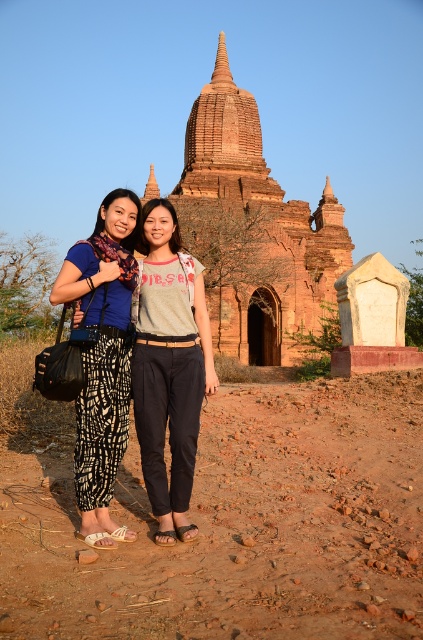
From the picture: Which of these two, brown dirt field at lower center or light gray cotton shirt at center, stands taller?

With more height is light gray cotton shirt at center.

Describe the element at coordinates (238, 525) in the screenshot. I see `brown dirt field at lower center` at that location.

The width and height of the screenshot is (423, 640). I want to click on brown dirt field at lower center, so click(238, 525).

Does rustic brick temple at center appear on the left side of light gray cotton shirt at center?

No, rustic brick temple at center is not to the left of light gray cotton shirt at center.

Is point (230, 109) less distant than point (137, 397)?

No.

Identify the location of rustic brick temple at center. Image resolution: width=423 pixels, height=640 pixels. (252, 228).

Find the location of a particular element. This screenshot has width=423, height=640. rustic brick temple at center is located at coordinates (252, 228).

Is brown dirt field at lower center positioned before rustic brick temple at center?

Yes, brown dirt field at lower center is closer to the viewer.

Between brown dirt field at lower center and rustic brick temple at center, which one appears on the left side from the viewer's perspective?

brown dirt field at lower center

Is point (323, 461) farther from viewer compared to point (231, 99)?

No, it is not.

The image size is (423, 640). I want to click on brown dirt field at lower center, so click(x=238, y=525).